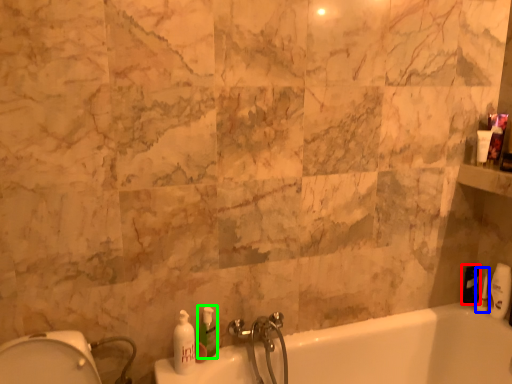
Question: Which object is positioned closest to toiletry (highlighted by a red box)? Select from toiletry (highlighted by a blue box) and soap dispenser (highlighted by a green box).

Choices:
 (A) toiletry
 (B) soap dispenser

Answer: (A)